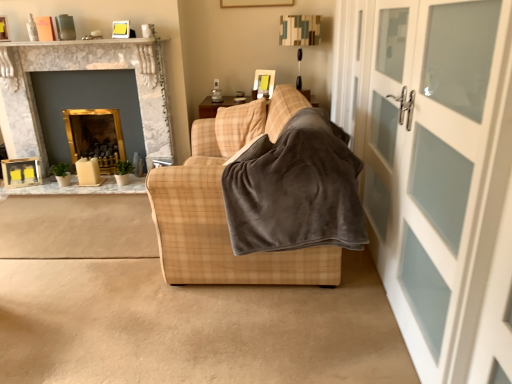
Identify the location of free location in front of wooden table at left. The width and height of the screenshot is (512, 384). (68, 215).